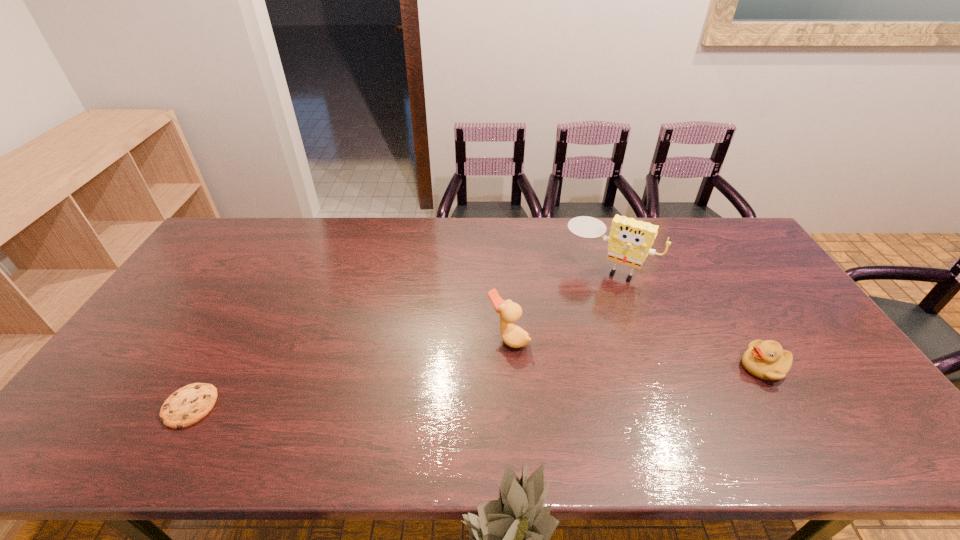
Locate an element on the screen. The height and width of the screenshot is (540, 960). free space on the desktop that is between the cookie and the second shortest object and is positioned on the front-facing side of the tallest object is located at coordinates (544, 382).

Find the location of a particular element. free spot on the desktop that is between the leftmost object and the rightmost object and is positioned on the beak of the third shortest object is located at coordinates (441, 389).